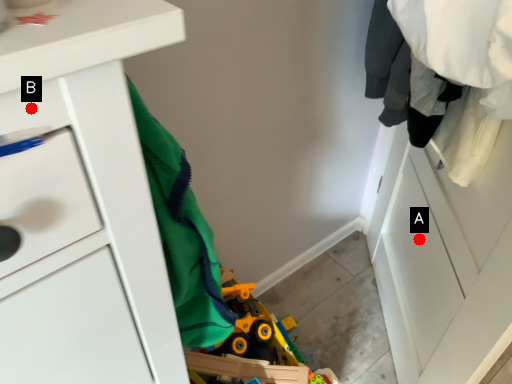
Question: Two points are circled on the image, labeled by A and B beside each circle. Which of the following is the farthest from the observer?

Choices:
 (A) A is further
 (B) B is further

Answer: (A)